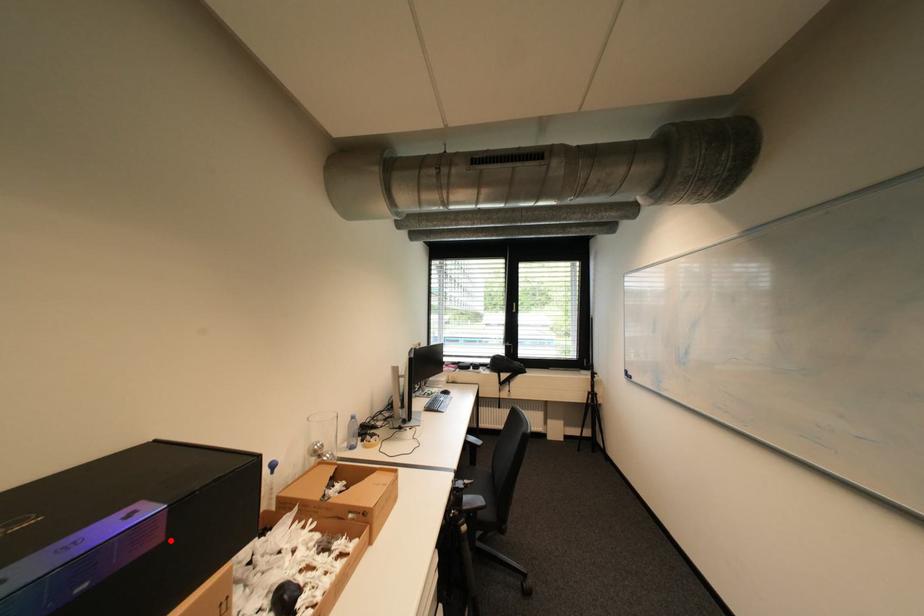
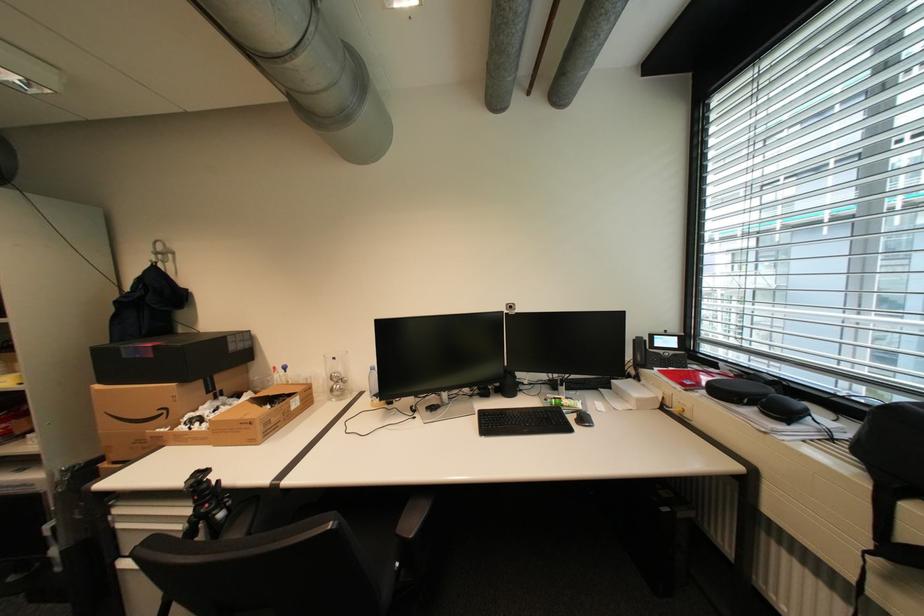
Locate, in the second image, the point that corresponds to the highlighted location in the first image.

(161, 357)